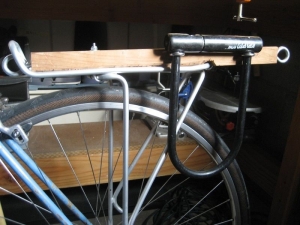
Locate an element on the screen. The image size is (300, 225). walls is located at coordinates (x=151, y=21), (x=43, y=38).